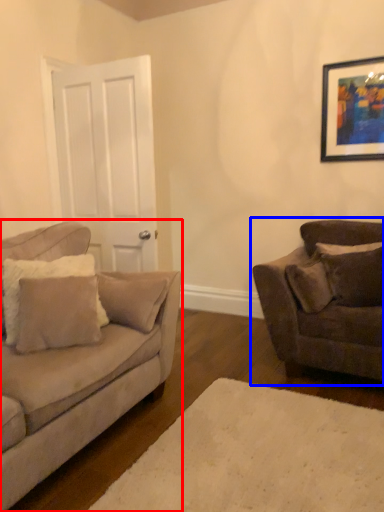
Question: Which object appears closest to the camera in this image, studio couch (highlighted by a red box) or studio couch (highlighted by a blue box)?

Choices:
 (A) studio couch
 (B) studio couch

Answer: (A)